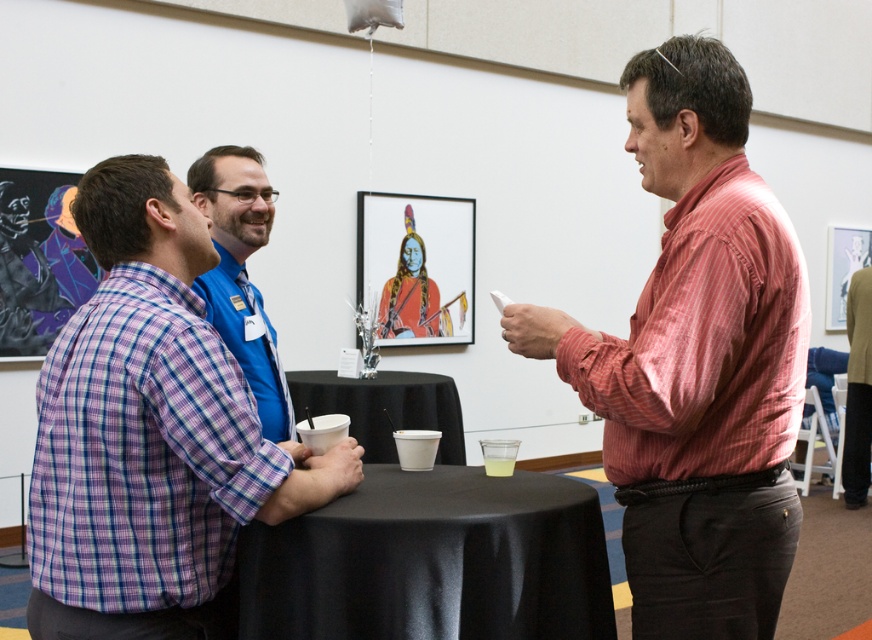
Question: Which point is farther from the camera taking this photo?

Choices:
 (A) (864, 451)
 (B) (683, 358)
 (C) (353, 410)

Answer: (A)

Question: Is red plaid shirt at right to the right of black satin table at center from the viewer's perspective?

Choices:
 (A) no
 (B) yes

Answer: (B)

Question: Considering the relative positions of blue shirt at center and dark brown leather jacket at lower right in the image provided, where is blue shirt at center located with respect to dark brown leather jacket at lower right?

Choices:
 (A) below
 (B) above

Answer: (B)

Question: Which object is positioned closest to the red plaid shirt at right?

Choices:
 (A) black satin table at center
 (B) black cloth table at center
 (C) purple checkered shirt at left

Answer: (A)

Question: Can you confirm if purple checkered shirt at left is thinner than black satin table at center?

Choices:
 (A) yes
 (B) no

Answer: (A)

Question: Which object is the closest to the red plaid shirt at right?

Choices:
 (A) purple checkered shirt at left
 (B) blue shirt at center
 (C) black cloth table at center

Answer: (A)